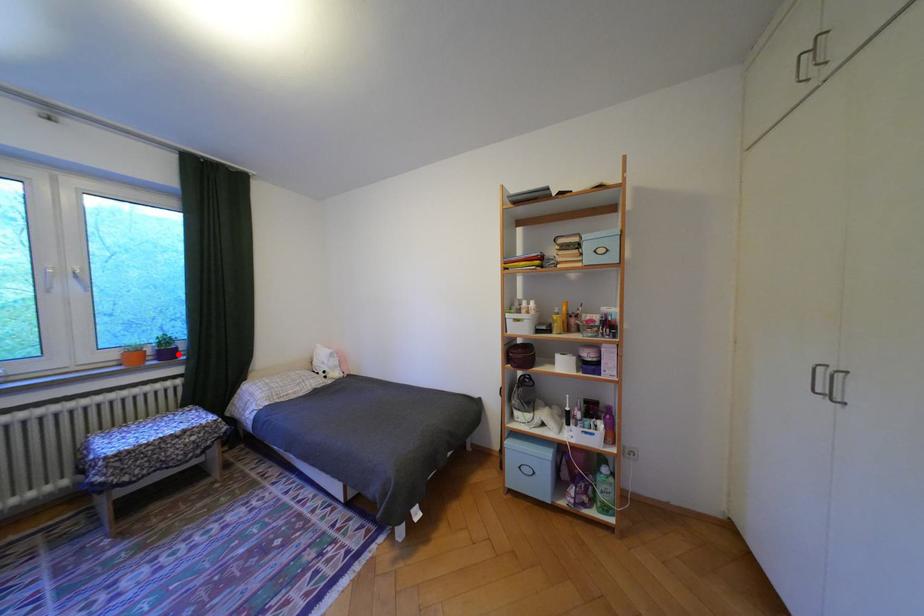
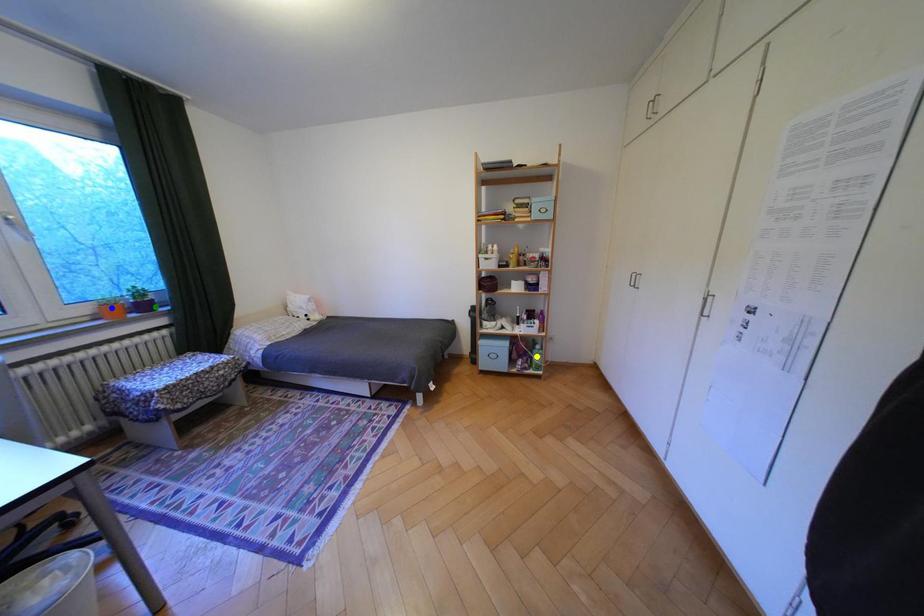
Question: I am providing you with two images of the same scene from different viewpoints. A red point is marked on the first image. You are given multiple points on the second image. Which mark in image 2 goes with the point in image 1?

Choices:
 (A) yellow point
 (B) blue point
 (C) green point

Answer: (C)